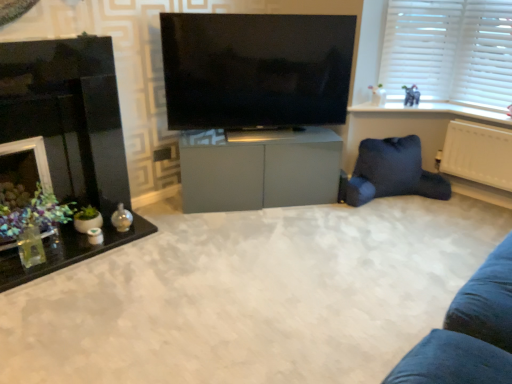
What is the approximate width of white plastic radiator at right?

white plastic radiator at right is 5.62 inches in width.

The height and width of the screenshot is (384, 512). Describe the element at coordinates (261, 170) in the screenshot. I see `matte gray cabinet at center` at that location.

Find the location of a particular element. This screenshot has height=384, width=512. white plastic blinds at upper right is located at coordinates (449, 51).

Which object is positioned more to the right, matte gray cabinet at center or matte gray elephant at upper right?

matte gray elephant at upper right is more to the right.

You are a GUI agent. You are given a task and a screenshot of the screen. Output one action in this format:
    pyautogui.click(x=<x>, y=<y>)
    Task: Click on the toy above the matte gray cabinet at center (from the image's perspective)
    
    Given the screenshot: What is the action you would take?
    pyautogui.click(x=411, y=95)

Does flat screen tv at center turn towards dark blue fabric bean bag at lower right?

No, flat screen tv at center does not turn towards dark blue fabric bean bag at lower right.

Is flat screen tv at center at the right side of dark blue fabric bean bag at lower right?

Incorrect, flat screen tv at center is not on the right side of dark blue fabric bean bag at lower right.

In the scene shown: From the image's perspective, between black glossy fireplace at left and matte gray cabinet at center, who is located below?

matte gray cabinet at center.

Is point (34, 87) positioned after point (438, 264)?

That is False.

Based on their sizes in the image, would you say black glossy fireplace at left is bigger or smaller than matte gray cabinet at center?

Clearly, black glossy fireplace at left is larger in size than matte gray cabinet at center.

Is matte gray elephant at upper right not near matte gray cabinet at center?

Yes, matte gray elephant at upper right and matte gray cabinet at center are located far from each other.

Can you tell me how much matte gray elephant at upper right and matte gray cabinet at center differ in facing direction?

138 degrees separate the facing orientations of matte gray elephant at upper right and matte gray cabinet at center.

Considering their positions, is matte gray elephant at upper right located in front of or behind matte gray cabinet at center?

matte gray elephant at upper right is positioned farther from the viewer than matte gray cabinet at center.

Is matte gray elephant at upper right thinner than matte gray cabinet at center?

Yes, matte gray elephant at upper right is thinner than matte gray cabinet at center.

Does point (413, 104) lie in front of point (509, 163)?

No, it is behind (509, 163).

From the image's perspective, which one is positioned higher, matte gray elephant at upper right or white plastic radiator at right?

matte gray elephant at upper right.

From a real-world perspective, who is located higher, matte gray elephant at upper right or white plastic radiator at right?

In real-world perspective, matte gray elephant at upper right is above.

Is matte gray elephant at upper right to the left or to the right of white plastic radiator at right in the image?

Based on their positions, matte gray elephant at upper right is located to the left of white plastic radiator at right.

From the picture: Is translucent glass table at left turned away from white plastic blinds at upper right?

No.

From a real-world perspective, is translucent glass table at left beneath white plastic blinds at upper right?

Indeed, from a real-world perspective, translucent glass table at left is positioned beneath white plastic blinds at upper right.

Is translucent glass table at left far away from white plastic blinds at upper right?

Yes.

Who is smaller, translucent glass table at left or white plastic blinds at upper right?

white plastic blinds at upper right.

Between translucent glass table at left and matte gray cabinet at center, which one has larger width?

matte gray cabinet at center.

Considering the points (48, 251) and (109, 360), which point is in front, point (48, 251) or point (109, 360)?

The point (109, 360) is in front.

Between translucent glass table at left and matte gray cabinet at center, which one is positioned behind?

translucent glass table at left.

Is translucent glass table at left placed right next to matte gray cabinet at center?

There is a gap between translucent glass table at left and matte gray cabinet at center.

Find the location of `toy behind the matte gray cabinet at center`. toy behind the matte gray cabinet at center is located at coordinates point(411,95).

The image size is (512, 384). Identify the location of television that appears in front of the dark blue fabric bean bag at lower right. (256, 70).

Looking at the image, which one is located further to white plastic blinds at upper right, flat screen tv at center or matte gray cabinet at center?

matte gray cabinet at center is positioned further to the anchor white plastic blinds at upper right.

From the image, which object appears to be farther from matte gray cabinet at center, dark blue fabric bean bag at lower right or translucent glass table at left?

translucent glass table at left is positioned further to the anchor matte gray cabinet at center.

Looking at the image, which one is located closer to flat screen tv at center, white plastic blinds at upper right or matte gray cabinet at center?

white plastic blinds at upper right lies closer to flat screen tv at center than the other object.

Which object lies nearer to the anchor point flat screen tv at center, black glossy fireplace at left or matte gray cabinet at center?

Based on the image, matte gray cabinet at center appears to be nearer to flat screen tv at center.

Estimate the real-world distances between objects in this image. Which object is closer to matte gray cabinet at center, black glossy fireplace at left or dark blue fabric bean bag at lower right?

Among the two, dark blue fabric bean bag at lower right is located nearer to matte gray cabinet at center.

From the picture: Considering their positions, is matte gray cabinet at center positioned further to matte gray elephant at upper right than black glossy fireplace at left?

The object further to matte gray elephant at upper right is black glossy fireplace at left.

Looking at the image, which one is located closer to translucent glass table at left, white plastic blinds at upper right or dark blue fabric bean bag at lower right?

dark blue fabric bean bag at lower right lies closer to translucent glass table at left than the other object.

Consider the image. When comparing their distances from matte gray elephant at upper right, does matte gray cabinet at center or matte gray cabinet at center seem closer?

Based on the image, matte gray cabinet at center appears to be nearer to matte gray elephant at upper right.

This screenshot has width=512, height=384. Identify the location of television situated between translucent glass table at left and dark blue fabric bean bag at lower right from left to right. (256, 70).

Where is `television between matte gray cabinet at center and white plastic radiator at right along the z-axis`? television between matte gray cabinet at center and white plastic radiator at right along the z-axis is located at coordinates (256, 70).

You are a GUI agent. You are given a task and a screenshot of the screen. Output one action in this format:
    pyautogui.click(x=<x>, y=<y>)
    Task: Click on the radiator between matte gray cabinet at center and white plastic blinds at upper right in the front-back direction
    This screenshot has height=384, width=512.
    Given the screenshot: What is the action you would take?
    pyautogui.click(x=478, y=153)

Find the location of a particular element. The image size is (512, 384). toy situated between matte gray cabinet at center and white plastic blinds at upper right from left to right is located at coordinates (411, 95).